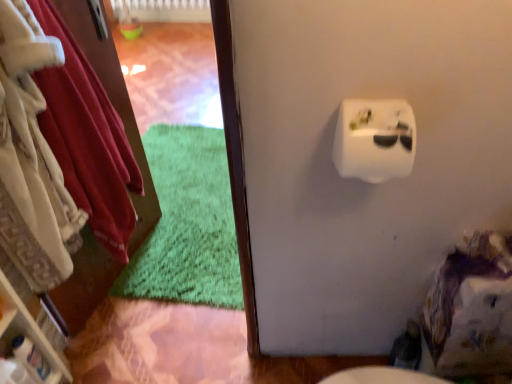
Measure the distance between point (101,120) and camera.

A distance of 1.40 meters exists between point (101,120) and camera.

Locate an element on the screen. white plastic toilet paper at upper right is located at coordinates (374, 139).

Does white plastic toilet paper at upper right contain white plastic shelf at left?

No, white plastic shelf at left is located outside of white plastic toilet paper at upper right.

From a real-world perspective, between white plastic toilet paper at upper right and white plastic shelf at left, who is vertically higher?

white plastic toilet paper at upper right, from a real-world perspective.

Looking at this image, from their relative heights in the image, would you say white plastic toilet paper at upper right is taller or shorter than white plastic shelf at left?

Clearly, white plastic toilet paper at upper right is shorter compared to white plastic shelf at left.

Is point (399, 136) closer or farther from the camera than point (89, 144)?

Point (399, 136) is positioned closer to the camera compared to point (89, 144).

Are white plastic toilet paper at upper right and velvety white robe at left located far from each other?

That's not correct — white plastic toilet paper at upper right is a little close to velvety white robe at left.

Could you tell me if white plastic toilet paper at upper right is turned towards velvety white robe at left?

No.

Which object is further away from the camera taking this photo, white plastic toilet paper at upper right or velvety white robe at left?

white plastic toilet paper at upper right is more distant.

Visually, is velvety white robe at left positioned to the left or to the right of white plastic toilet paper at upper right?

In the image, velvety white robe at left appears on the left side of white plastic toilet paper at upper right.

Can you confirm if velvety white robe at left is thinner than white plastic toilet paper at upper right?

No.

From the image's perspective, is velvety white robe at left above or below white plastic toilet paper at upper right?

From the image's perspective, velvety white robe at left appears above white plastic toilet paper at upper right.

Is velvety white robe at left at the left side of white plastic shelf at left?

In fact, velvety white robe at left is to the right of white plastic shelf at left.

Does velvety white robe at left contain white plastic shelf at left?

No, white plastic shelf at left is not inside velvety white robe at left.

This screenshot has width=512, height=384. Identify the location of shelf behind the velvety white robe at left. (28, 334).

Which is closer, [72,84] or [13,313]?

Clearly, point [72,84] is more distant from the camera than point [13,313].

Can you confirm if white plastic shelf at left is thinner than white plastic toilet paper at upper right?

In fact, white plastic shelf at left might be wider than white plastic toilet paper at upper right.

Which point is more forward, (64, 382) or (393, 136)?

Positioned in front is point (393, 136).

Which is more to the left, white plastic shelf at left or white plastic toilet paper at upper right?

white plastic shelf at left is more to the left.

Can you tell me how much white plastic shelf at left and white plastic toilet paper at upper right differ in facing direction?

The angular difference between white plastic shelf at left and white plastic toilet paper at upper right is 82.3 degrees.

Can you confirm if white plastic shelf at left is thinner than velvety white robe at left?

Yes, white plastic shelf at left is thinner than velvety white robe at left.

Does white plastic shelf at left come in front of velvety white robe at left?

No, it is not.

Which object is positioned more to the right, white plastic shelf at left or velvety white robe at left?

velvety white robe at left.

Which is behind, point (4, 323) or point (77, 67)?

The point (77, 67) is farther.

Identify the location of toilet paper that is on the right side of white plastic shelf at left. (374, 139).

The width and height of the screenshot is (512, 384). I want to click on toilet paper lying below the velvety white robe at left (from the image's perspective), so click(x=374, y=139).

Looking at the image, which one is located further to white plastic toilet paper at upper right, velvety white robe at left or white plastic shelf at left?

white plastic shelf at left is further to white plastic toilet paper at upper right.

Estimate the real-world distances between objects in this image. Which object is closer to velvety white robe at left, white plastic shelf at left or white plastic toilet paper at upper right?

The object closer to velvety white robe at left is white plastic shelf at left.

Based on their spatial positions, is white plastic toilet paper at upper right or velvety white robe at left closer to white plastic shelf at left?

velvety white robe at left lies closer to white plastic shelf at left than the other object.

Estimate the real-world distances between objects in this image. Which object is further from velvety white robe at left, white plastic toilet paper at upper right or white plastic shelf at left?

Based on the image, white plastic toilet paper at upper right appears to be further to velvety white robe at left.

When comparing their distances from white plastic toilet paper at upper right, does white plastic shelf at left or velvety white robe at left seem further?

white plastic shelf at left is further to white plastic toilet paper at upper right.

Considering their positions, is velvety white robe at left positioned further to white plastic shelf at left than white plastic toilet paper at upper right?

Among the two, white plastic toilet paper at upper right is located further to white plastic shelf at left.

Identify the location of clothing between white plastic shelf at left and white plastic toilet paper at upper right. (87, 138).